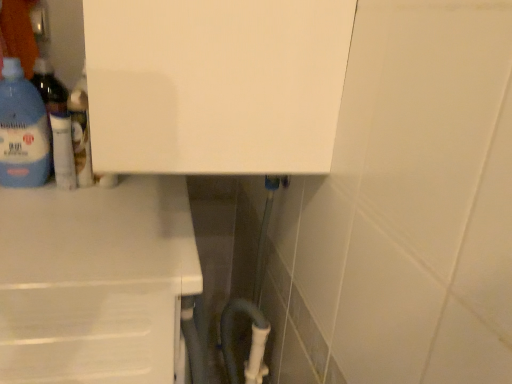
You are a GUI agent. You are given a task and a screenshot of the screen. Output one action in this format:
    pyautogui.click(x=<x>, y=<y>)
    Task: Click on the free space in front of white glossy lotion at upper left, marked as the 1th bottle in a right-to-left arrangement
    
    Given the screenshot: What is the action you would take?
    pyautogui.click(x=62, y=204)